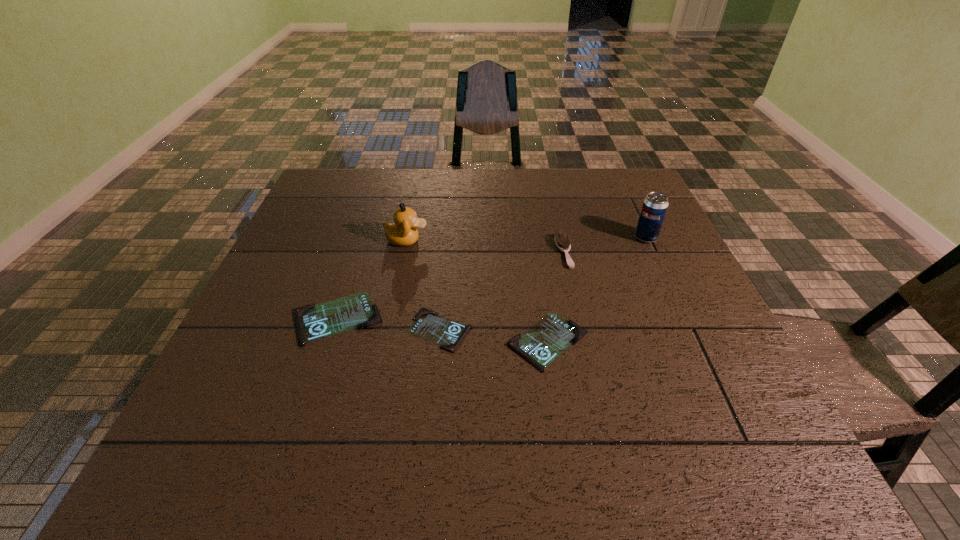
The width and height of the screenshot is (960, 540). What are the coordinates of `free space for a new identity card on the right` in the screenshot? It's located at (662, 354).